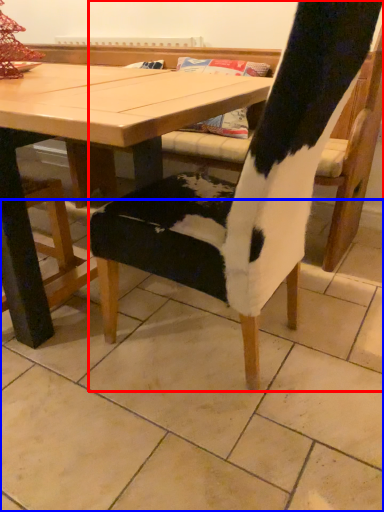
Question: Which object is closer to the camera taking this photo, chair (highlighted by a red box) or tile (highlighted by a blue box)?

Choices:
 (A) chair
 (B) tile

Answer: (B)